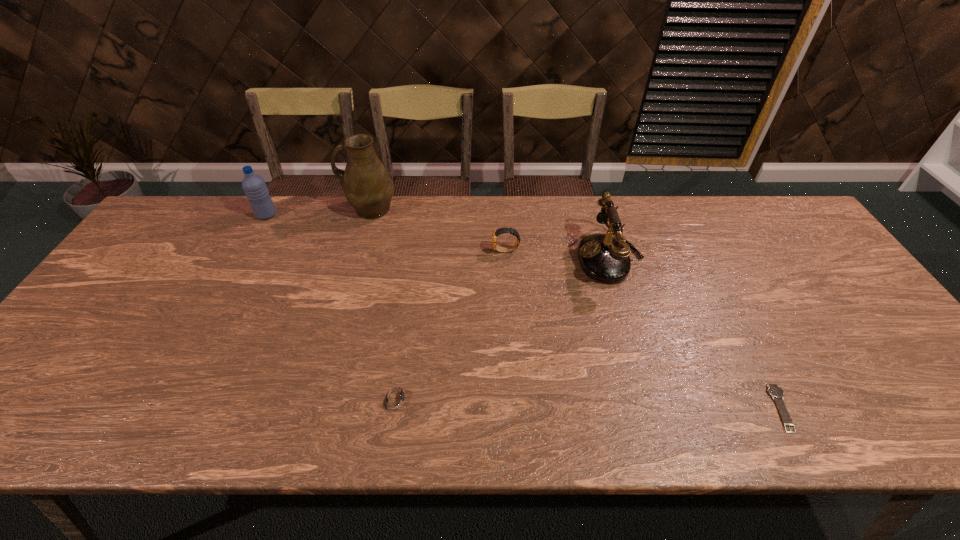
The image size is (960, 540). I want to click on vacant region located on the handle side of the second object from left to right, so click(252, 209).

Locate an element on the screen. Image resolution: width=960 pixels, height=540 pixels. vacant space situated on the handle side of the second object from left to right is located at coordinates click(x=260, y=209).

I want to click on blank space located on the handle side of the second object from left to right, so click(285, 209).

Find the location of a particular element. The image size is (960, 540). blank space located on the back of the water bottle is located at coordinates (275, 200).

You are a GUI agent. You are given a task and a screenshot of the screen. Output one action in this format:
    pyautogui.click(x=<x>, y=<y>)
    Task: Click on the vacant region located on the dial of the fifth object from left to right
    Image resolution: width=960 pixels, height=540 pixels.
    Given the screenshot: What is the action you would take?
    [x=467, y=257]

You are a GUI agent. You are given a task and a screenshot of the screen. Output one action in this format:
    pyautogui.click(x=<x>, y=<y>)
    Task: Click on the free point located on the dial of the fifth object from left to right
    Image resolution: width=960 pixels, height=540 pixels.
    Given the screenshot: What is the action you would take?
    pyautogui.click(x=445, y=257)

You are a GUI agent. You are given a task and a screenshot of the screen. Output one action in this format:
    pyautogui.click(x=<x>, y=<y>)
    Task: Click on the free location located 0.300m on the dial of the fifth object from left to right
    This screenshot has height=540, width=960.
    Given the screenshot: What is the action you would take?
    pyautogui.click(x=473, y=257)

You are a GUI agent. You are given a task and a screenshot of the screen. Output one action in this format:
    pyautogui.click(x=<x>, y=<y>)
    Task: Click on the free region located on the face of the farthest watch
    This screenshot has width=960, height=540.
    Given the screenshot: What is the action you would take?
    pyautogui.click(x=451, y=251)

Locate an element on the screen. This screenshot has height=540, width=960. vacant space located on the face of the farthest watch is located at coordinates (396, 251).

This screenshot has height=540, width=960. Identify the location of vacant space situated on the face of the farthest watch. (367, 251).